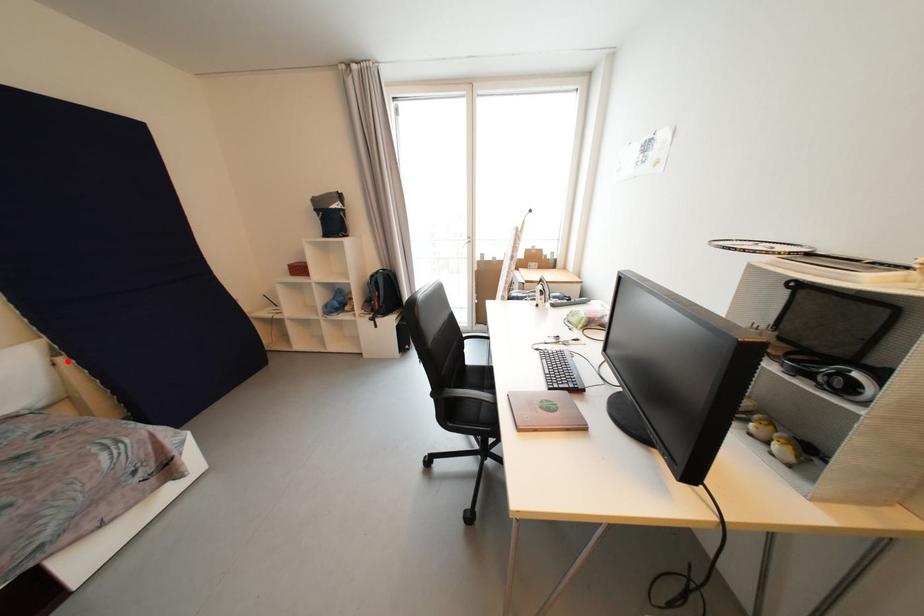
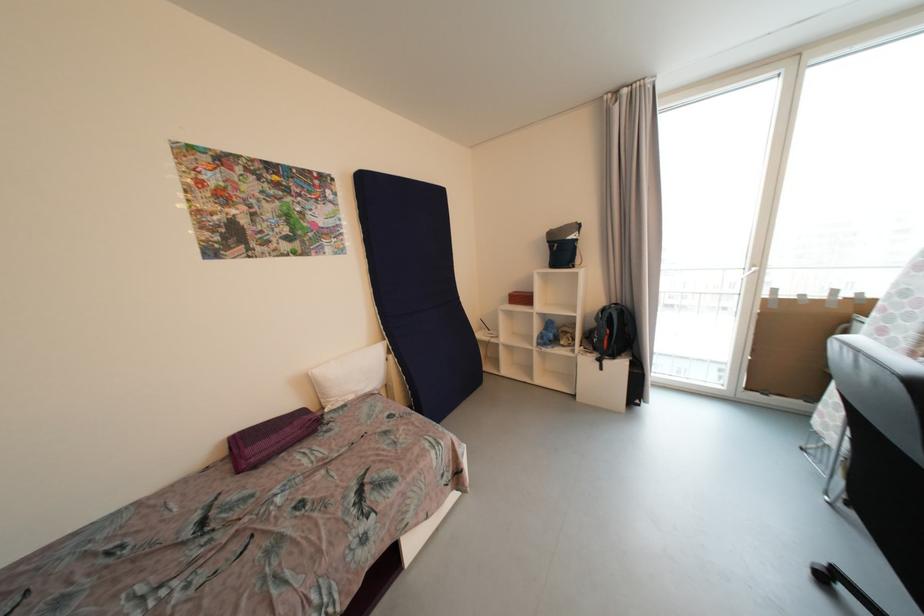
The point at the highlighted location is marked in the first image. Where is the corresponding point in the second image?

(396, 359)